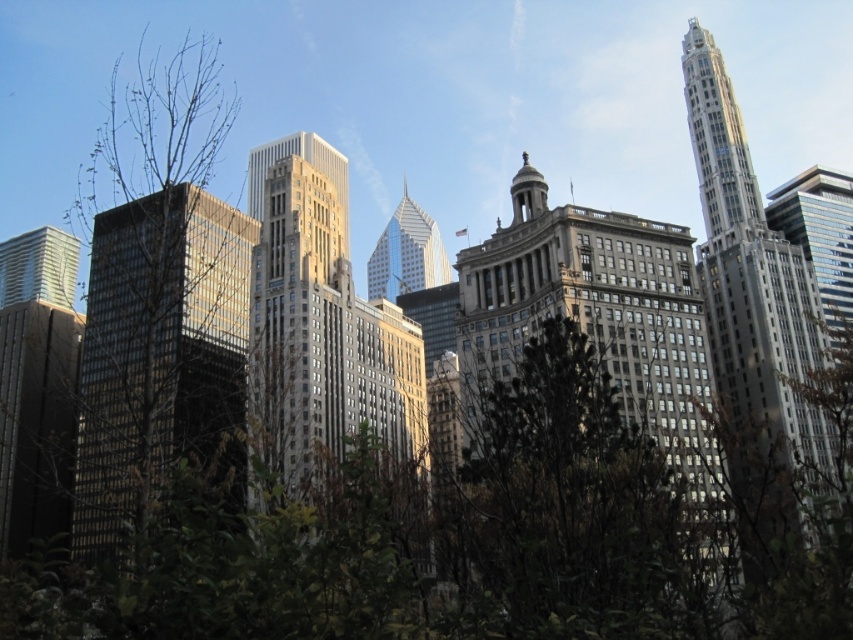
You are an architect evaluating the urban layout. Given the gray glass skyscraper at center and the silver glass skyscraper at right, which one has a greater width?

The gray glass skyscraper at center has a greater width than the silver glass skyscraper at right.

You are standing in the urban skyline scene and want to take a photo. There are two points of interest marked as point 1 at coordinates point (653,316) and point 2 at coordinates point (728,374). Which point is closer to your current position?

Point (653,316) is closer to the camera than point (728,374), so point 1 is closer to your current position.

You are a tourist standing in the city square and want to take a photo of both the brown stone building at center and the matte glass skyscraper at left. Since you can only focus on one building at a time, which one should you position closer to the camera to ensure both are in the frame?

You should position the matte glass skyscraper at left closer to the camera because the brown stone building at center is to the right of the matte glass skyscraper at left, so adjusting the angle to include both would require focusing on the closer one first.